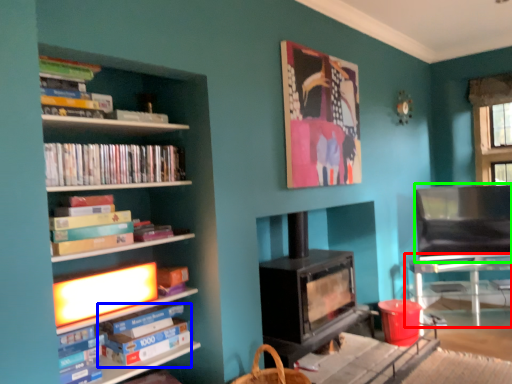
Question: Which is nearer to the table (highlighted by a red box)? paperback book (highlighted by a blue box) or armchair (highlighted by a green box).

Choices:
 (A) paperback book
 (B) armchair

Answer: (B)